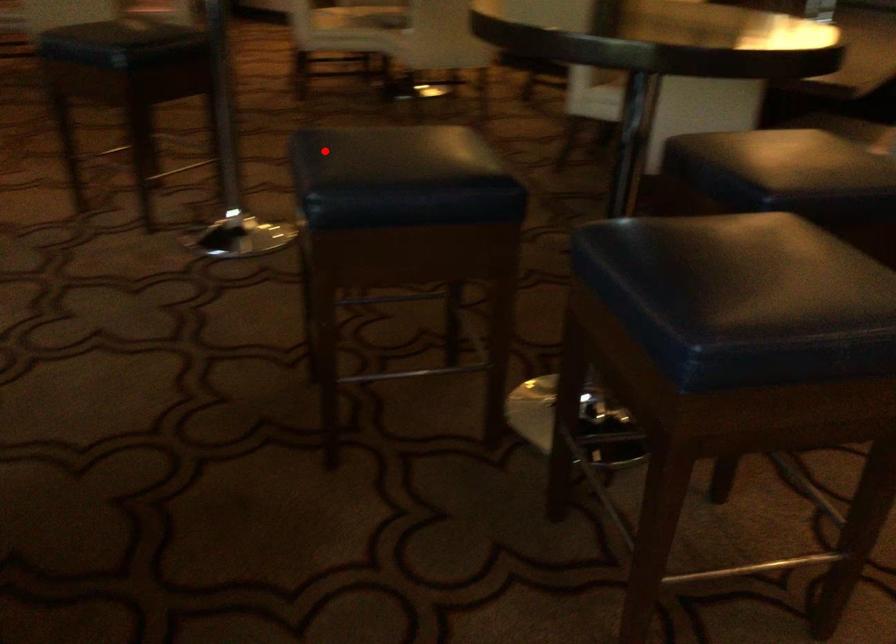
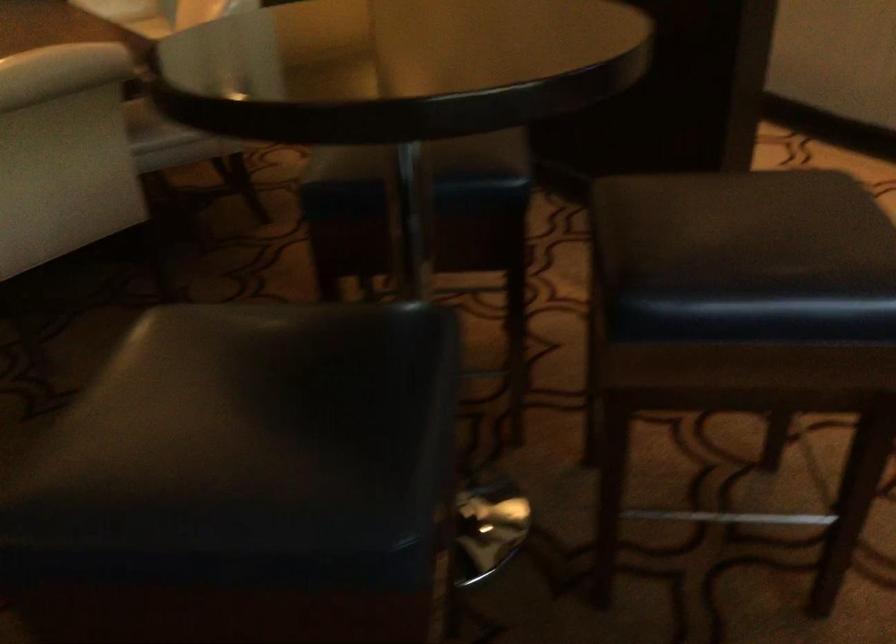
Question: I am providing you with two images of the same scene from different viewpoints. Image1 has a red point marked. In image2, the corresponding 3D location appears at what relative position? Reply with the corresponding letter.

Choices:
 (A) Closer
 (B) Farther

Answer: (A)